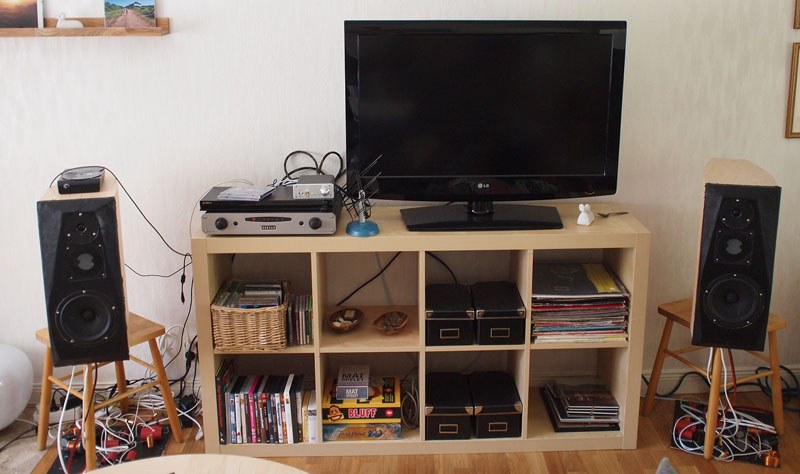
You are a GUI agent. You are given a task and a screenshot of the screen. Output one action in this format:
    pyautogui.click(x=<x>, y=<y>)
    Task: Click on the books
    The height and width of the screenshot is (474, 800).
    Given the screenshot: What is the action you would take?
    pyautogui.click(x=269, y=417)